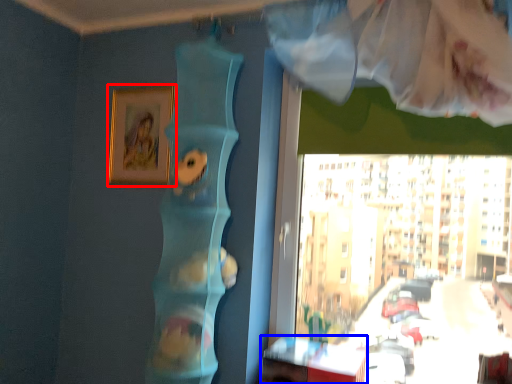
Question: Which of the following is the closest to the observer, picture frame (highlighted by a red box) or table (highlighted by a blue box)?

Choices:
 (A) picture frame
 (B) table

Answer: (B)